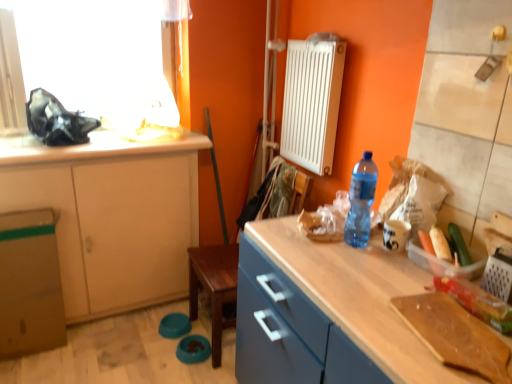
Question: Is the position of translucent plastic container at right less distant than that of white matte countertop at upper left?

Choices:
 (A) no
 (B) yes

Answer: (B)

Question: From the image's perspective, is translucent plastic container at right located beneath white matte countertop at upper left?

Choices:
 (A) yes
 (B) no

Answer: (A)

Question: Is white matte countertop at upper left completely or partially inside translucent plastic container at right?

Choices:
 (A) no
 (B) yes

Answer: (A)

Question: Does translucent plastic container at right have a lesser width compared to white matte countertop at upper left?

Choices:
 (A) yes
 (B) no

Answer: (A)

Question: Does translucent plastic container at right have a greater height compared to white matte countertop at upper left?

Choices:
 (A) yes
 (B) no

Answer: (A)

Question: Considering the relative sizes of translucent plastic container at right and white matte countertop at upper left in the image provided, is translucent plastic container at right shorter than white matte countertop at upper left?

Choices:
 (A) no
 (B) yes

Answer: (A)

Question: Is matte wood cabinet at left not near blue plastic bottle at right?

Choices:
 (A) yes
 (B) no

Answer: (A)

Question: Is matte wood cabinet at left smaller than blue plastic bottle at right?

Choices:
 (A) yes
 (B) no

Answer: (B)

Question: Considering the relative sizes of matte wood cabinet at left and blue plastic bottle at right in the image provided, is matte wood cabinet at left shorter than blue plastic bottle at right?

Choices:
 (A) yes
 (B) no

Answer: (B)

Question: From the image's perspective, is matte wood cabinet at left beneath blue plastic bottle at right?

Choices:
 (A) no
 (B) yes

Answer: (B)

Question: Is matte wood cabinet at left wider than blue plastic bottle at right?

Choices:
 (A) no
 (B) yes

Answer: (B)

Question: Is matte wood cabinet at left beside blue plastic bottle at right?

Choices:
 (A) yes
 (B) no

Answer: (B)

Question: Are green plastic bag at right, marked as the 2th vegetable in a back-to-front arrangement, and translucent plastic container at right far apart?

Choices:
 (A) yes
 (B) no

Answer: (B)